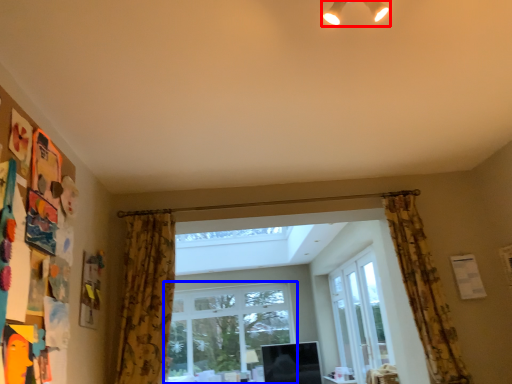
Question: Which of the following is the closest to the observer, light fixture (highlighted by a red box) or window (highlighted by a blue box)?

Choices:
 (A) light fixture
 (B) window

Answer: (A)